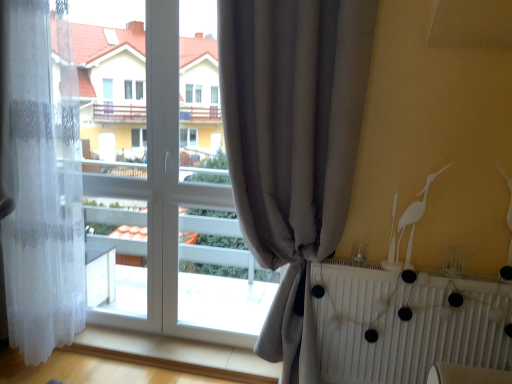
Question: Is white lace curtain at left, arranged as the 2th curtain when viewed from the right, outside of white matte radiator at lower right?

Choices:
 (A) yes
 (B) no

Answer: (A)

Question: Is white lace curtain at left, arranged as the 2th curtain when viewed from the right, at the left side of white matte radiator at lower right?

Choices:
 (A) yes
 (B) no

Answer: (A)

Question: From the image's perspective, is white lace curtain at left, the 1th curtain viewed from the left, beneath white matte radiator at lower right?

Choices:
 (A) no
 (B) yes

Answer: (A)

Question: From the image's perspective, is white lace curtain at left, arranged as the 2th curtain when viewed from the right, located above white matte radiator at lower right?

Choices:
 (A) yes
 (B) no

Answer: (A)

Question: From a real-world perspective, is white lace curtain at left, the 1th curtain viewed from the left, below white matte radiator at lower right?

Choices:
 (A) yes
 (B) no

Answer: (B)

Question: Is white lace curtain at left, arranged as the 2th curtain when viewed from the right, touching white matte radiator at lower right?

Choices:
 (A) yes
 (B) no

Answer: (B)

Question: Can you confirm if white matte radiator at lower right is positioned to the left of white lace curtain at left, the 1th curtain viewed from the left?

Choices:
 (A) no
 (B) yes

Answer: (A)

Question: From the image's perspective, is white matte radiator at lower right beneath white lace curtain at left, the 1th curtain viewed from the left?

Choices:
 (A) yes
 (B) no

Answer: (A)

Question: Is white matte radiator at lower right completely or partially outside of white lace curtain at left, the 1th curtain viewed from the left?

Choices:
 (A) yes
 (B) no

Answer: (A)

Question: From a real-world perspective, is white matte radiator at lower right under white lace curtain at left, the 1th curtain viewed from the left?

Choices:
 (A) no
 (B) yes

Answer: (B)

Question: Considering the relative sizes of white matte radiator at lower right and white lace curtain at left, the 1th curtain viewed from the left, in the image provided, is white matte radiator at lower right bigger than white lace curtain at left, the 1th curtain viewed from the left,?

Choices:
 (A) yes
 (B) no

Answer: (B)

Question: Is there a large distance between white matte radiator at lower right and white lace curtain at left, arranged as the 2th curtain when viewed from the right?

Choices:
 (A) yes
 (B) no

Answer: (A)

Question: Does gray fabric curtain at center, marked as the second curtain in a left-to-right arrangement, come behind white lace curtain at left, the 1th curtain viewed from the left?

Choices:
 (A) no
 (B) yes

Answer: (A)